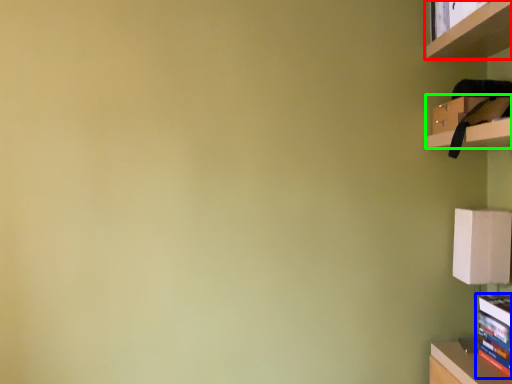
Question: Which is nearer to the shelf (highlighted by a red box)? book (highlighted by a blue box) or cabinet (highlighted by a green box).

Choices:
 (A) book
 (B) cabinet

Answer: (B)